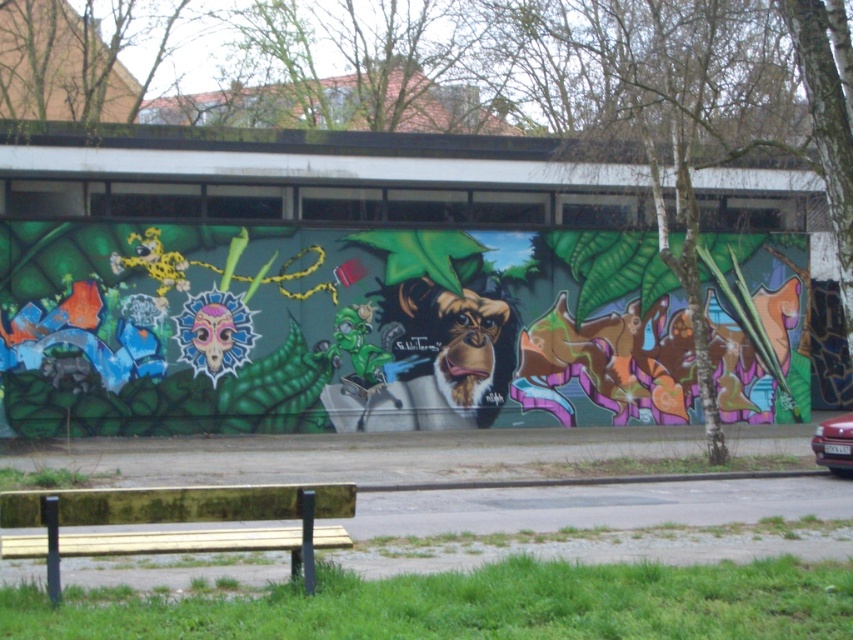
You are standing in front of the vibrant mural and want to determine which of the two points, point [338,499] or point [827,424], is closer to you. Based on the scene description, which point is nearer?

Point [338,499] is closer to the camera than point [827,424], so it is the nearer point.